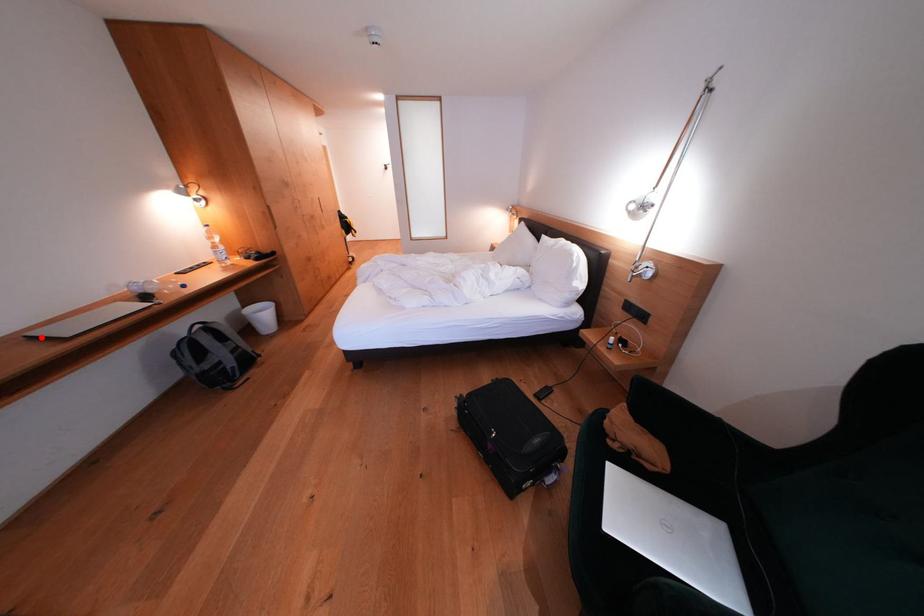
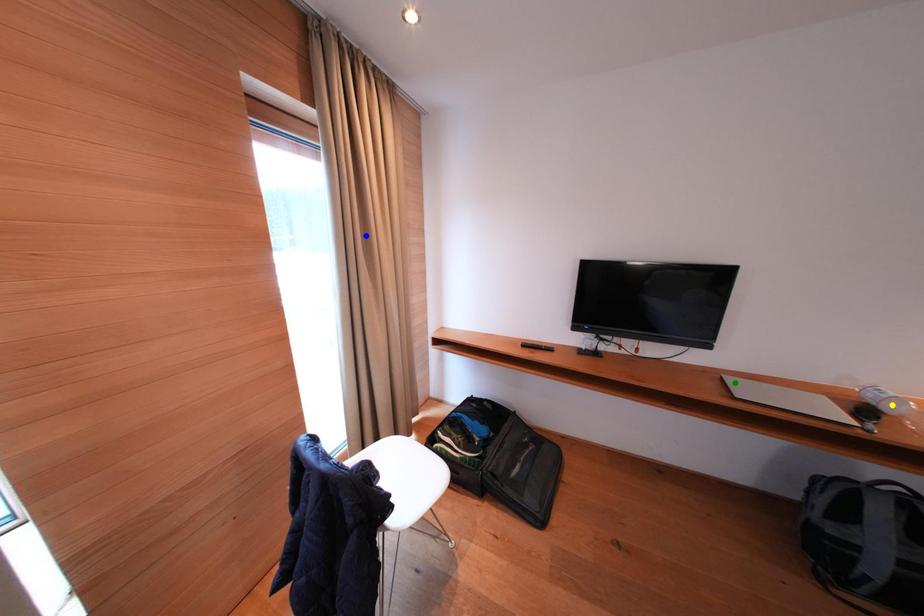
Question: I am providing you with two images of the same scene from different viewpoints. A red point is marked on the first image. You are given multiple points on the second image. Which spot in image 2 lines up with the point in image 1?

Choices:
 (A) green point
 (B) blue point
 (C) yellow point

Answer: (A)